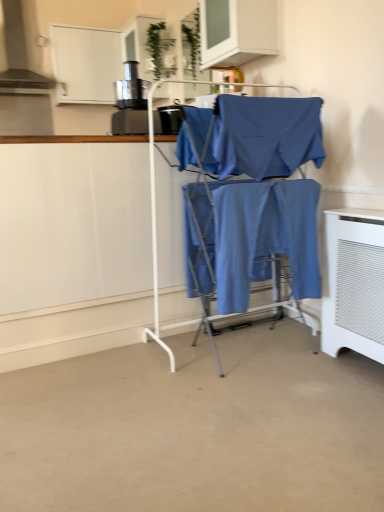
This screenshot has height=512, width=384. Identify the location of matte blue fabric at center. (156, 226).

This screenshot has width=384, height=512. I want to click on white mesh radiator at lower right, so click(354, 283).

Describe the element at coordinates (263, 237) in the screenshot. I see `blue cotton pants at center, which is counted as the second fabric, starting from the top` at that location.

Describe the element at coordinates (237, 31) in the screenshot. I see `white glossy cabinet at upper center` at that location.

Locate an element on the screen. blue cotton fabric at center, the first fabric in the top-to-bottom sequence is located at coordinates (266, 135).

You are a GUI agent. You are given a task and a screenshot of the screen. Output one action in this format:
    pyautogui.click(x=<x>, y=<y>)
    Task: Click on the furniture above the blue cotton pants at center, which is counted as the second fabric, starting from the top (from a real-world perspective)
    
    Given the screenshot: What is the action you would take?
    pyautogui.click(x=156, y=226)

Is matte blue fabric at center positioned beyond the bounds of blue cotton pants at center, which is counted as the second fabric, starting from the top?

That's correct, matte blue fabric at center is outside of blue cotton pants at center, which is counted as the second fabric, starting from the top.

From a real-world perspective, is matte blue fabric at center located beneath blue cotton pants at center, which is counted as the second fabric, starting from the top?

Incorrect, from a real-world perspective, matte blue fabric at center is higher than blue cotton pants at center, which is counted as the second fabric, starting from the top.

Between point (213, 83) and point (376, 220), which one is positioned behind?

The point (213, 83) is more distant.

From the image's perspective, which object appears higher, matte blue fabric at center or white mesh radiator at lower right?

matte blue fabric at center, from the image's perspective.

In terms of size, does matte blue fabric at center appear bigger or smaller than white mesh radiator at lower right?

Considering their sizes, matte blue fabric at center takes up more space than white mesh radiator at lower right.

Does matte blue fabric at center have a lesser height compared to white mesh radiator at lower right?

Incorrect, the height of matte blue fabric at center does not fall short of that of white mesh radiator at lower right.

From the image's perspective, which is below, metallic black coffee machine at upper left or blue cotton pants at center, which is counted as the second fabric, starting from the top?

blue cotton pants at center, which is counted as the second fabric, starting from the top, from the image's perspective.

Can you confirm if metallic black coffee machine at upper left is smaller than blue cotton pants at center, the first fabric when ordered from bottom to top?

Indeed, metallic black coffee machine at upper left has a smaller size compared to blue cotton pants at center, the first fabric when ordered from bottom to top.

How different are the orientations of metallic black coffee machine at upper left and blue cotton pants at center, which is counted as the second fabric, starting from the top, in degrees?

177 degrees separate the facing orientations of metallic black coffee machine at upper left and blue cotton pants at center, which is counted as the second fabric, starting from the top.

Does metallic black coffee machine at upper left come behind blue cotton pants at center, the first fabric when ordered from bottom to top?

Yes, it is behind blue cotton pants at center, the first fabric when ordered from bottom to top.

Is metallic black coffee machine at upper left surrounded by white glossy cabinet at upper center?

No, metallic black coffee machine at upper left is not surrounded by white glossy cabinet at upper center.

Based on the photo, looking at the image, does white glossy cabinet at upper center seem bigger or smaller compared to metallic black coffee machine at upper left?

In the image, white glossy cabinet at upper center appears to be larger than metallic black coffee machine at upper left.

Is white glossy cabinet at upper center at the back of matte blue fabric at center?

matte blue fabric at center does not have its back to white glossy cabinet at upper center.

There is a matte blue fabric at center. Find the location of `cabinetry above it (from a real-world perspective)`. cabinetry above it (from a real-world perspective) is located at coordinates (237, 31).

Is matte blue fabric at center surrounding white glossy cabinet at upper center?

Definitely not — white glossy cabinet at upper center is not inside matte blue fabric at center.

Between matte blue fabric at center and white glossy cabinet at upper center, which one has less height?

white glossy cabinet at upper center is shorter.

Which is more to the right, blue cotton fabric at center, which is the second fabric from bottom to top, or metallic black coffee machine at upper left?

Positioned to the right is blue cotton fabric at center, which is the second fabric from bottom to top.

From a real-world perspective, which is physically above, blue cotton fabric at center, which is the second fabric from bottom to top, or metallic black coffee machine at upper left?

metallic black coffee machine at upper left, from a real-world perspective.

Find the location of a particular element. fabric that is the 1st one when counting rightward from the metallic black coffee machine at upper left is located at coordinates (266, 135).

Looking at this image, would you say blue cotton fabric at center, the first fabric in the top-to-bottom sequence, is inside or outside metallic black coffee machine at upper left?

The correct answer is: outside.

From a real-world perspective, is white glossy cabinet at upper center over blue cotton fabric at center, which is the second fabric from bottom to top?

Yes, from a real-world perspective, white glossy cabinet at upper center is over blue cotton fabric at center, which is the second fabric from bottom to top

Based on the photo, is white glossy cabinet at upper center wider than blue cotton fabric at center, the first fabric in the top-to-bottom sequence?

Indeed, white glossy cabinet at upper center has a greater width compared to blue cotton fabric at center, the first fabric in the top-to-bottom sequence.

Is white glossy cabinet at upper center in front of blue cotton fabric at center, the first fabric in the top-to-bottom sequence?

No.

Image resolution: width=384 pixels, height=512 pixels. I want to click on fabric below the matte blue fabric at center (from the image's perspective), so click(263, 237).

Identify the location of home appliance that appears on the right of matte blue fabric at center. The height and width of the screenshot is (512, 384). (354, 283).

Looking at the image, which one is located closer to white mesh radiator at lower right, metallic black coffee machine at upper left or white glossy cabinet at upper center?

white glossy cabinet at upper center is closer to white mesh radiator at lower right.

Estimate the real-world distances between objects in this image. Which object is further from blue cotton pants at center, which is counted as the second fabric, starting from the top, blue cotton fabric at center, which is the second fabric from bottom to top, or matte blue fabric at center?

The object further to blue cotton pants at center, which is counted as the second fabric, starting from the top, is matte blue fabric at center.

Estimate the real-world distances between objects in this image. Which object is further from metallic black coffee machine at upper left, white glossy cabinet at upper center or blue cotton pants at center, which is counted as the second fabric, starting from the top?

blue cotton pants at center, which is counted as the second fabric, starting from the top, is positioned further to the anchor metallic black coffee machine at upper left.

When comparing their distances from metallic black coffee machine at upper left, does blue cotton pants at center, the first fabric when ordered from bottom to top, or white glossy cabinet at upper center seem further?

The object further to metallic black coffee machine at upper left is blue cotton pants at center, the first fabric when ordered from bottom to top.

Considering their positions, is blue cotton fabric at center, which is the second fabric from bottom to top, positioned closer to matte blue fabric at center than white glossy cabinet at upper center?

The object closer to matte blue fabric at center is blue cotton fabric at center, which is the second fabric from bottom to top.

When comparing their distances from blue cotton pants at center, which is counted as the second fabric, starting from the top, does white glossy cabinet at upper center or matte blue fabric at center seem closer?

matte blue fabric at center lies closer to blue cotton pants at center, which is counted as the second fabric, starting from the top, than the other object.

Looking at the image, which one is located closer to matte blue fabric at center, white glossy cabinet at upper center or white mesh radiator at lower right?

white glossy cabinet at upper center.

Which object lies further to the anchor point blue cotton fabric at center, the first fabric in the top-to-bottom sequence, white mesh radiator at lower right or metallic black coffee machine at upper left?

metallic black coffee machine at upper left.

Locate an element on the screen. coffee machine that lies between white glossy cabinet at upper center and matte blue fabric at center from top to bottom is located at coordinates (130, 102).

Locate an element on the screen. fabric between white glossy cabinet at upper center and blue cotton pants at center, which is counted as the second fabric, starting from the top, in the up-down direction is located at coordinates (266, 135).

Identify the location of coffee machine between white glossy cabinet at upper center and blue cotton pants at center, which is counted as the second fabric, starting from the top, from top to bottom. Image resolution: width=384 pixels, height=512 pixels. (130, 102).

Identify the location of furniture between white glossy cabinet at upper center and white mesh radiator at lower right vertically. (156, 226).